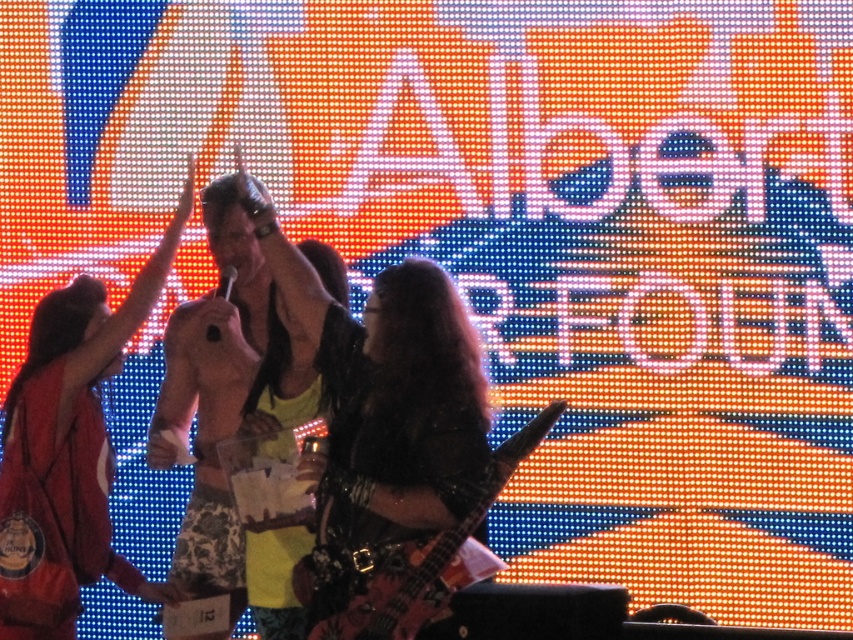
You are a photographer at the concert and want to capture both the shiny black dress at center and the wooden electric guitar at center in a single frame. Given that your camera has a fixed focal length, which object should you focus on to ensure both are in focus?

Since the shiny black dress at center is larger than the wooden electric guitar at center, you should focus on the shiny black dress at center to ensure both are in focus.

You are standing at the event and want to approach the shiny black dress at center to ask a question. Considering the distance, can you comfortably walk up to it without feeling too far?

The shiny black dress at center is 20.36 meters away from you, which is quite a distance. Walking that far might feel a bit strenuous, so you might want to consider if there is a closer point or another way to interact.